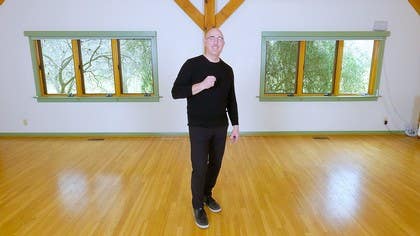
Find the location of a particular element. This screenshot has height=236, width=420. hardwood floors is located at coordinates (130, 172).